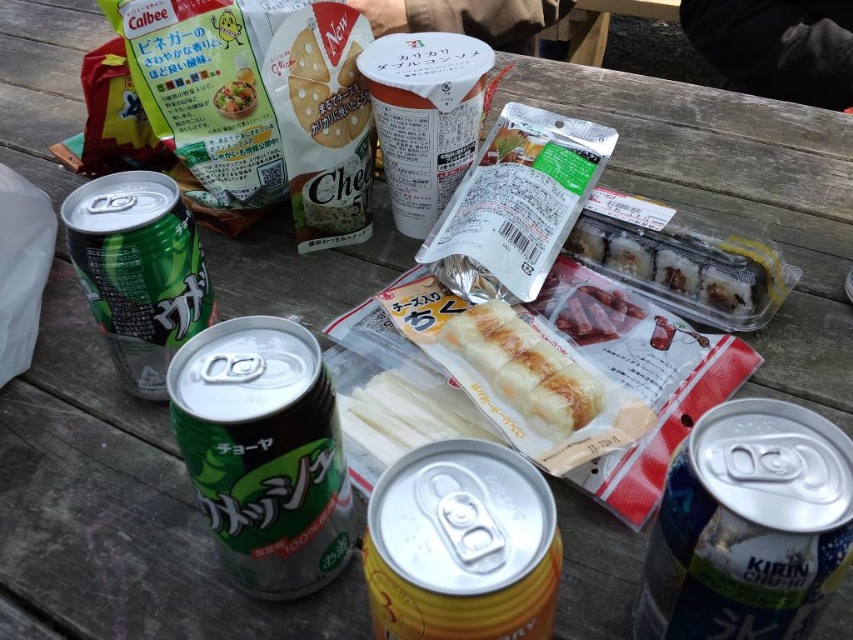
Question: Based on their relative distances, which object is farther from the white paper cheese crackers at center?

Choices:
 (A) matte plastic bag at upper left
 (B) golden brown bread at center

Answer: (B)

Question: Does green matte can at center appear under clear plastic sushi at center?

Choices:
 (A) yes
 (B) no

Answer: (A)

Question: From the image, what is the correct spatial relationship of blue metallic can at lower right in relation to white paper cheese crackers at center?

Choices:
 (A) right
 (B) left

Answer: (A)

Question: Considering the relative positions of clear plastic sushi at center and matte plastic bag at upper left in the image provided, where is clear plastic sushi at center located with respect to matte plastic bag at upper left?

Choices:
 (A) below
 (B) above

Answer: (A)

Question: Which object is positioned closest to the shiny red meat at center?

Choices:
 (A) white paper cheese crackers at center
 (B) golden brown bread at center
 (C) matte plastic bag at upper left

Answer: (B)

Question: Which point appears closest to the camera in this image?

Choices:
 (A) (582, 316)
 (B) (252, 458)
 (C) (488, 580)
 (D) (328, 138)

Answer: (C)